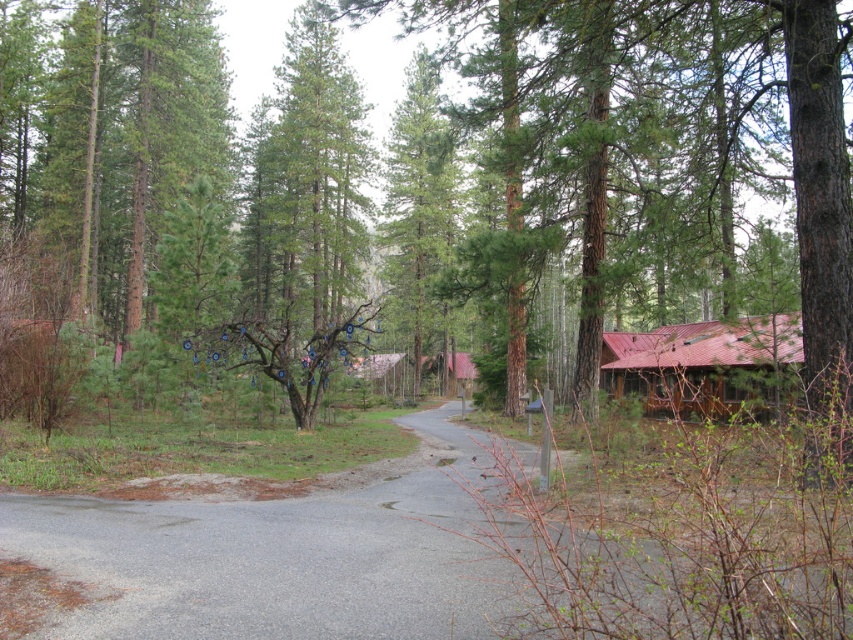
You are standing at the point marked by point (418,177) in the image. Looking around, you see a green matte tree at center. What direction is the green matte tree at center relative to your current position?

The point (418,177) marks the green matte tree at center, so you are already at the base of the green matte tree at center.

You are driving a car and see the green matte tree at center and the metallic red cabin at right ahead on the road. Which object will you pass first as you continue driving forward?

The green matte tree at center will be passed first because it is positioned on the left side of the metallic red cabin at right, meaning it is closer to the driver as they move forward along the road.